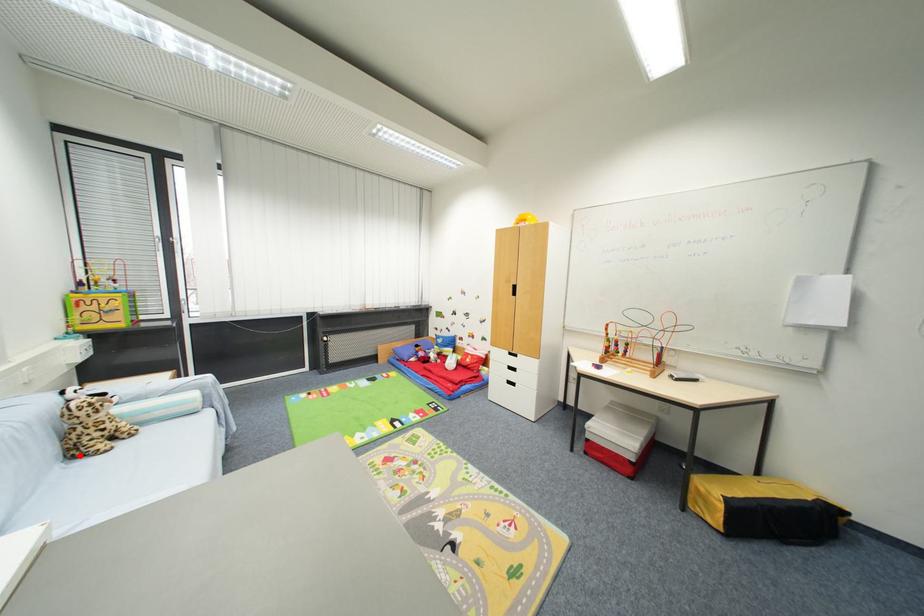
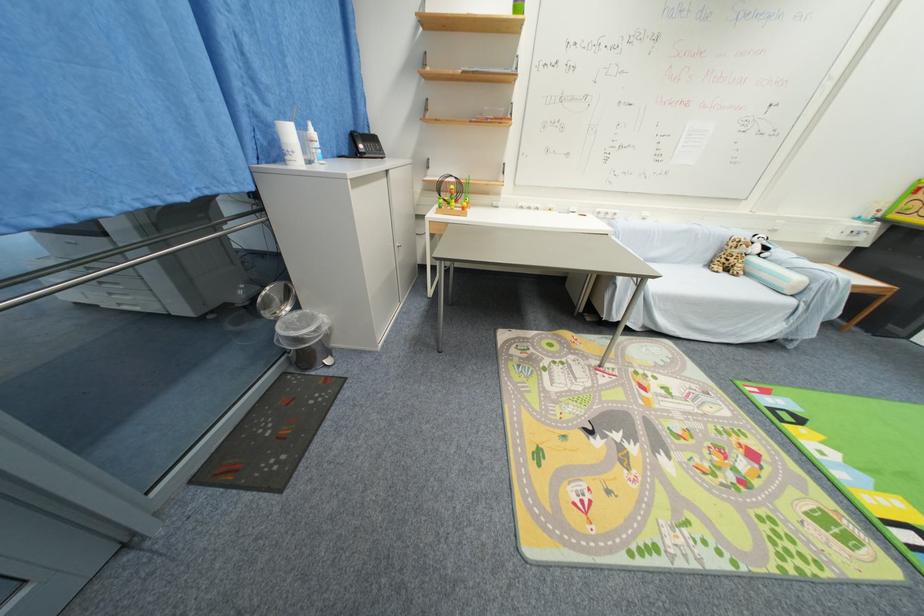
Find the pixel in the second image that matches the highlighted location in the first image.

(714, 265)